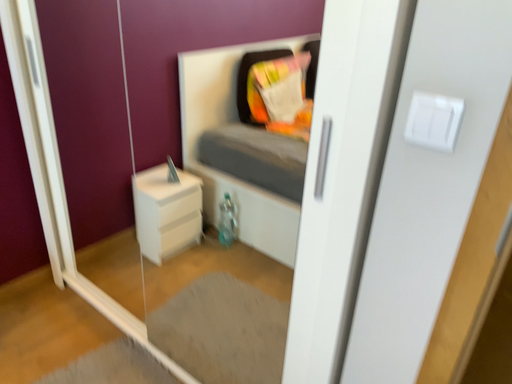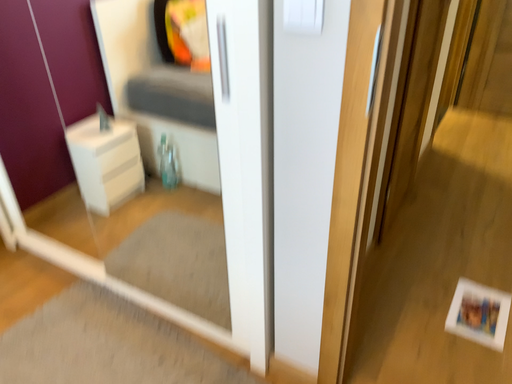
Question: How did the camera likely rotate when shooting the video?

Choices:
 (A) rotated right
 (B) rotated left

Answer: (A)